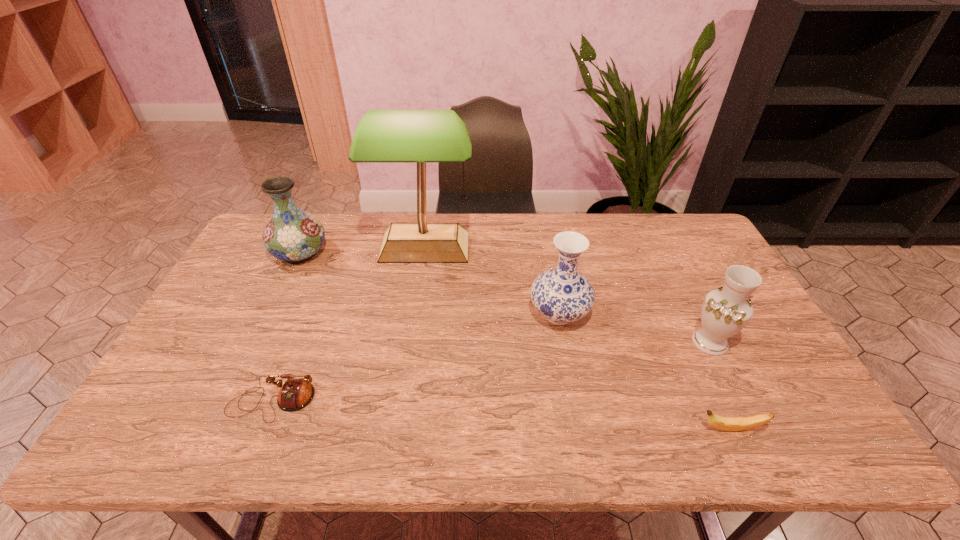
Identify the location of banana positioned at the right edge. (722, 423).

Locate an element on the screen. The width and height of the screenshot is (960, 540). object present at the far left corner is located at coordinates (293, 235).

Find the location of a particular element. This screenshot has height=540, width=960. object that is positioned at the near right corner is located at coordinates (722, 423).

The image size is (960, 540). I want to click on vacant space at the far edge of the desktop, so click(x=445, y=215).

The height and width of the screenshot is (540, 960). In order to click on vacant point at the near edge in this screenshot , I will do `click(354, 421)`.

In order to click on free space at the left edge of the desktop in this screenshot , I will do `click(259, 299)`.

The width and height of the screenshot is (960, 540). Identify the location of free space at the right edge. (784, 389).

This screenshot has height=540, width=960. I want to click on vacant space at the near left corner of the desktop, so click(x=151, y=447).

Where is `vacant space at the far right corner of the desktop`? The height and width of the screenshot is (540, 960). vacant space at the far right corner of the desktop is located at coordinates (679, 232).

The height and width of the screenshot is (540, 960). I want to click on free space between the telephone and the rightmost vase, so click(x=492, y=372).